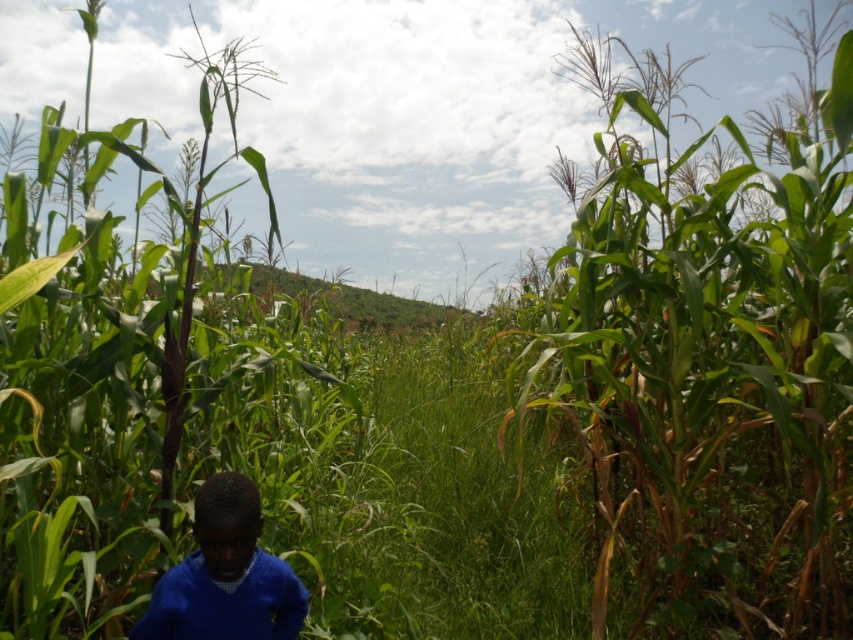
Question: Which of the following is the closest to the observer?

Choices:
 (A) blue sweater at lower left
 (B) green leafy corn at center

Answer: (A)

Question: Is green leafy corn at center bigger than blue sweater at lower left?

Choices:
 (A) no
 (B) yes

Answer: (B)

Question: Does green leafy corn at center have a smaller size compared to blue sweater at lower left?

Choices:
 (A) no
 (B) yes

Answer: (A)

Question: Which of the following is the farthest from the observer?

Choices:
 (A) blue sweater at lower left
 (B) green leafy corn at center

Answer: (B)

Question: Does green leafy corn at center have a smaller size compared to blue sweater at lower left?

Choices:
 (A) yes
 (B) no

Answer: (B)